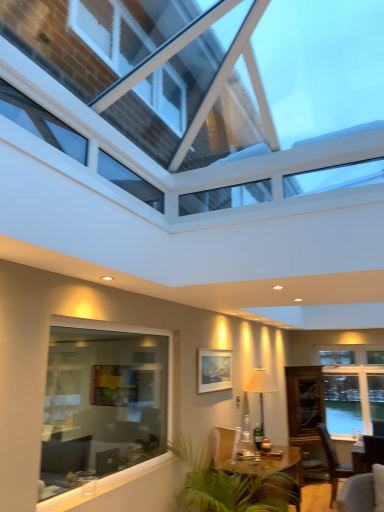
Question: Is clear glass window at lower left, which is the second window in front-to-back order, positioned far away from wooden table at center?

Choices:
 (A) no
 (B) yes

Answer: (B)

Question: Does clear glass window at lower left, which is the 2th window in back-to-front order, contain wooden table at center?

Choices:
 (A) yes
 (B) no

Answer: (B)

Question: Is clear glass window at lower left, which is the 2th window in back-to-front order, thinner than wooden table at center?

Choices:
 (A) yes
 (B) no

Answer: (A)

Question: Does clear glass window at lower left, which is the 2th window in back-to-front order, have a greater height compared to wooden table at center?

Choices:
 (A) yes
 (B) no

Answer: (A)

Question: Does clear glass window at lower left, which is the 2th window in back-to-front order, have a larger size compared to wooden table at center?

Choices:
 (A) yes
 (B) no

Answer: (B)

Question: Is clear glass window at lower left, which is the second window in front-to-back order, to the left of wooden table at center from the viewer's perspective?

Choices:
 (A) yes
 (B) no

Answer: (A)

Question: Does wooden table at center have a lesser width compared to clear glass window at lower left, which is the 2th window in back-to-front order?

Choices:
 (A) no
 (B) yes

Answer: (A)

Question: From the image's perspective, is wooden table at center beneath clear glass window at lower left, which is the second window in front-to-back order?

Choices:
 (A) yes
 (B) no

Answer: (A)

Question: Considering the relative positions of wooden table at center and clear glass window at lower left, which is the second window in front-to-back order, in the image provided, is wooden table at center behind clear glass window at lower left, which is the second window in front-to-back order,?

Choices:
 (A) yes
 (B) no

Answer: (A)

Question: Does wooden table at center have a greater height compared to clear glass window at lower left, which is the 2th window in back-to-front order?

Choices:
 (A) yes
 (B) no

Answer: (B)

Question: Is wooden table at center closer to the viewer compared to clear glass window at lower left, which is the second window in front-to-back order?

Choices:
 (A) yes
 (B) no

Answer: (B)

Question: Is wooden table at center oriented towards clear glass window at lower left, which is the 2th window in back-to-front order?

Choices:
 (A) yes
 (B) no

Answer: (B)

Question: Does matte white lamp at center come in front of transparent glass cabinet at right?

Choices:
 (A) yes
 (B) no

Answer: (A)